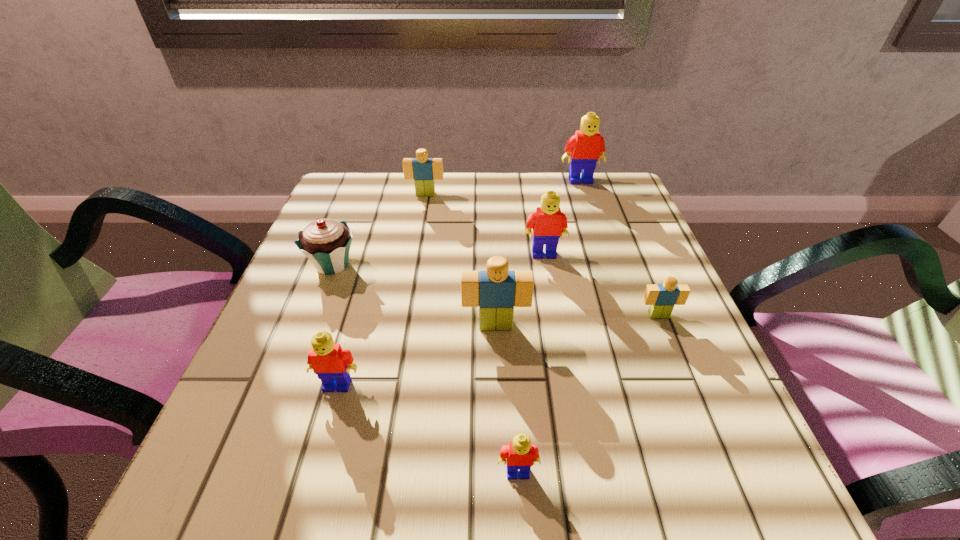
I want to click on object present at the near edge, so [520, 454].

I want to click on Lego situated at the left edge, so click(332, 365).

At what (x,y) coordinates should I click in order to perform the action: click on cupcake located in the left edge section of the desktop. Please return your answer as a coordinate pair (x, y). This screenshot has width=960, height=540. Looking at the image, I should click on (326, 243).

This screenshot has width=960, height=540. In order to click on object that is at the far right corner in this screenshot , I will do click(587, 146).

In the image, there is a desktop. At what (x,y) coordinates should I click in order to perform the action: click on vacant space at the far edge. Please return your answer as a coordinate pair (x, y). This screenshot has width=960, height=540. Looking at the image, I should click on (511, 219).

Locate an element on the screen. This screenshot has width=960, height=540. vacant space at the near edge is located at coordinates (475, 466).

In the image, there is a desktop. At what (x,y) coordinates should I click in order to perform the action: click on vacant space at the left edge. Please return your answer as a coordinate pair (x, y). This screenshot has height=540, width=960. Looking at the image, I should click on (245, 429).

In the image, there is a desktop. Where is `vacant space at the right edge`? The image size is (960, 540). vacant space at the right edge is located at coordinates (645, 327).

In the image, there is a desktop. Where is `free space at the far left corner`? Image resolution: width=960 pixels, height=540 pixels. free space at the far left corner is located at coordinates (348, 212).

Locate an element on the screen. The height and width of the screenshot is (540, 960). free spot at the far right corner of the desktop is located at coordinates (615, 193).